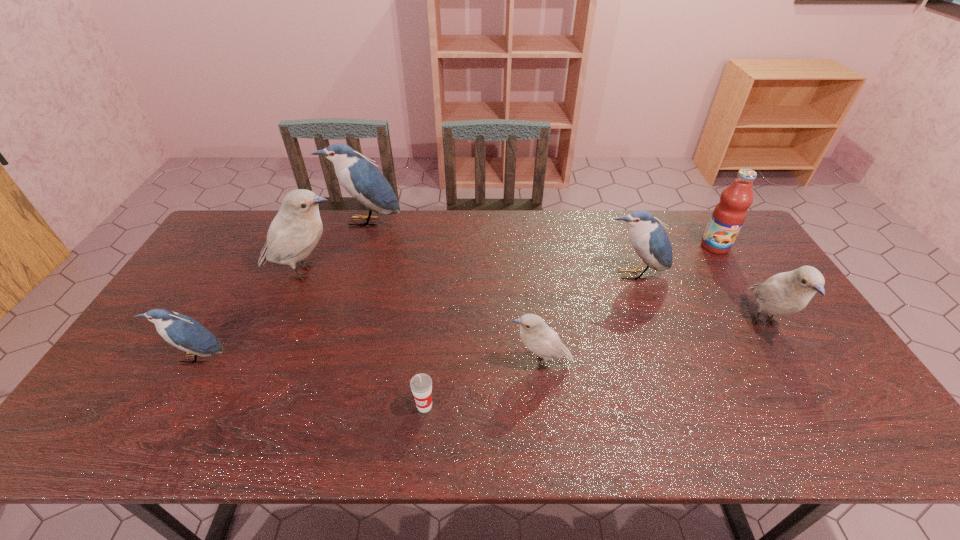
You are a GUI agent. You are given a task and a screenshot of the screen. Output one action in this format:
    pyautogui.click(x=<x>, y=<y>)
    Task: Click on the farthest object
    Image resolution: width=960 pixels, height=540 pixels.
    Given the screenshot: What is the action you would take?
    pyautogui.click(x=359, y=176)

Where is `the farthest bird`? the farthest bird is located at coordinates (359, 176).

At what (x,y) coordinates should I click in order to perform the action: click on the leftmost white bird. Please return your answer as a coordinate pair (x, y). The width and height of the screenshot is (960, 540). Looking at the image, I should click on (293, 234).

Image resolution: width=960 pixels, height=540 pixels. In order to click on the biggest white bird in this screenshot , I will do `click(293, 234)`.

Locate an element on the screen. fruit juice is located at coordinates (728, 216).

Locate an element on the screen. This screenshot has height=540, width=960. the second nearest blue bird is located at coordinates (649, 239).

This screenshot has width=960, height=540. Identify the location of the sixth object from left to right. (649, 239).

Identify the location of the second smallest white bird. (786, 293).

The height and width of the screenshot is (540, 960). I want to click on the second nearest white bird, so click(786, 293).

Identify the location of the smallest white bird. The width and height of the screenshot is (960, 540). (536, 335).